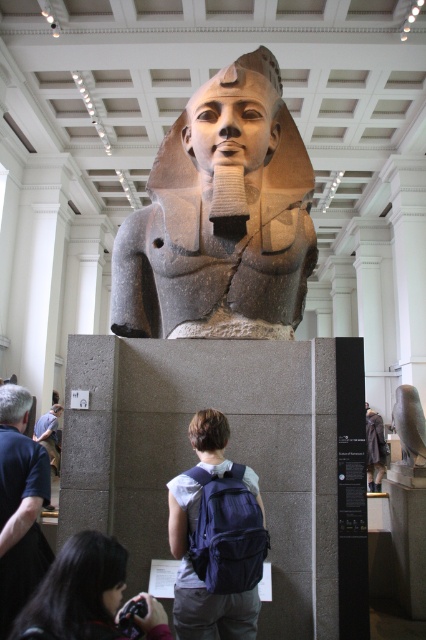
Question: Considering the relative positions of black matte hair at lower center and brown matte hair at center in the image provided, where is black matte hair at lower center located with respect to brown matte hair at center?

Choices:
 (A) below
 (B) above

Answer: (A)

Question: Can you confirm if dark blue shirt at lower left is wider than gray hair at upper left?

Choices:
 (A) no
 (B) yes

Answer: (B)

Question: Which object is positioned closest to the brown matte hair at center?

Choices:
 (A) fuzzy gray coat at lower right
 (B) dark blue shirt at lower left
 (C) blue fabric backpack at lower center

Answer: (C)

Question: Which point is closer to the camera?

Choices:
 (A) pyautogui.click(x=86, y=588)
 (B) pyautogui.click(x=46, y=616)
 (C) pyautogui.click(x=224, y=417)
 (D) pyautogui.click(x=28, y=404)

Answer: (B)

Question: Estimate the real-world distances between objects in this image. Which object is farther from the polished stone head at center?

Choices:
 (A) fuzzy gray coat at lower right
 (B) granite statue at center
 (C) brown matte hair at center
 (D) dark hair at lower left

Answer: (D)

Question: Is polished stone head at center to the left of brown matte hair at center from the viewer's perspective?

Choices:
 (A) no
 (B) yes

Answer: (A)